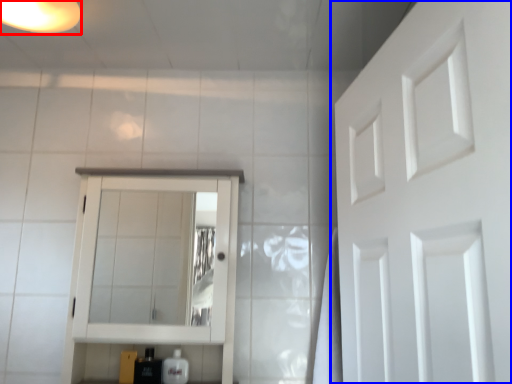
Question: Among these objects, which one is farthest to the camera, light fixture (highlighted by a red box) or door (highlighted by a blue box)?

Choices:
 (A) light fixture
 (B) door

Answer: (A)